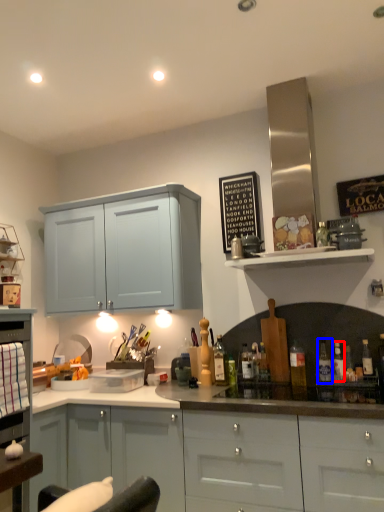
Question: Which of the following is the closest to the observer, bottle (highlighted by a red box) or bottle (highlighted by a blue box)?

Choices:
 (A) bottle
 (B) bottle

Answer: (A)